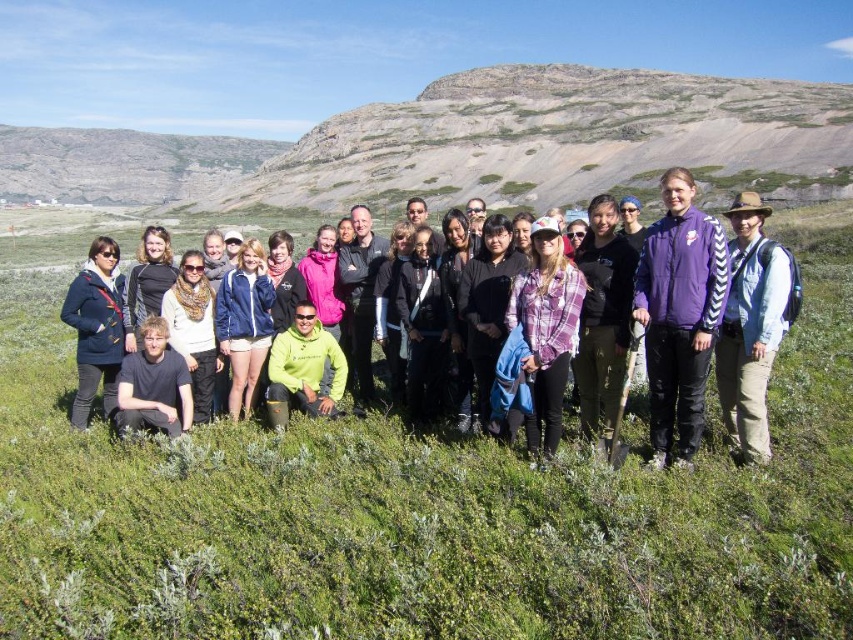
You are a photographer taking a picture of the group. You notice two points in the scene at coordinates point (x=679, y=177) and point (x=756, y=266). Which point is closer to the camera?

Point (x=756, y=266) is closer to the camera because it is less further than point (x=679, y=177), which is further away.

You are standing at the center of the image and want to walk towards the rocky terrain at upper center. What direction should you face to head directly towards it?

You should face the upper center direction to head directly towards the rocky terrain at upper center.